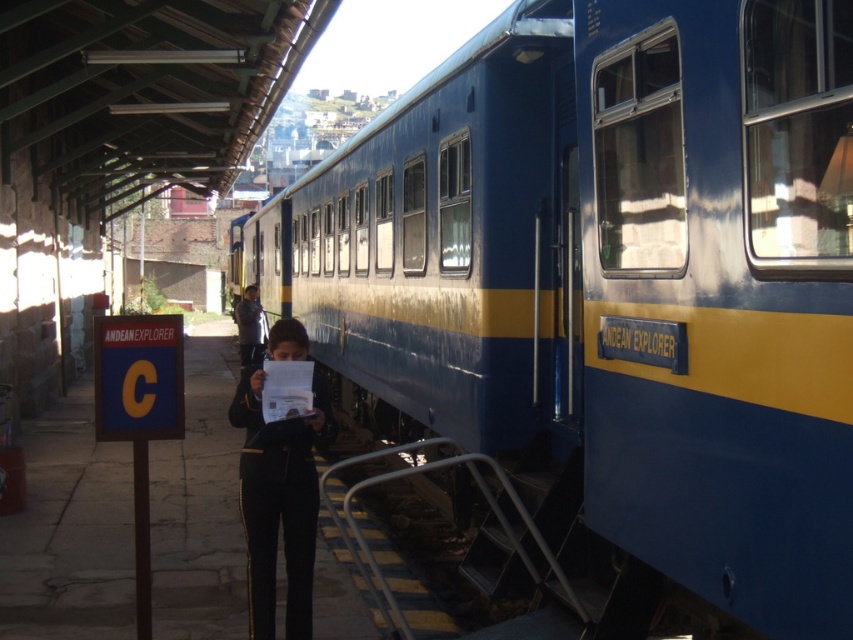
Question: Does blue polished metal train at center have a smaller size compared to black fabric pants at center?

Choices:
 (A) yes
 (B) no

Answer: (B)

Question: Considering the relative positions of blue polished metal train at center and dark blue uniform at center in the image provided, where is blue polished metal train at center located with respect to dark blue uniform at center?

Choices:
 (A) left
 (B) right

Answer: (B)

Question: Which object appears closest to the camera in this image?

Choices:
 (A) dark blue uniform at center
 (B) black fabric pants at center
 (C) blue polished metal train at center

Answer: (C)

Question: Which point is farther from the camera taking this photo?

Choices:
 (A) (252, 321)
 (B) (796, 298)
 (C) (274, 465)

Answer: (A)

Question: From the image, what is the correct spatial relationship of black fabric pants at center in relation to dark blue uniform at center?

Choices:
 (A) above
 (B) below

Answer: (B)

Question: Which object appears farthest from the camera in this image?

Choices:
 (A) blue polished metal train at center
 (B) black fabric pants at center

Answer: (B)